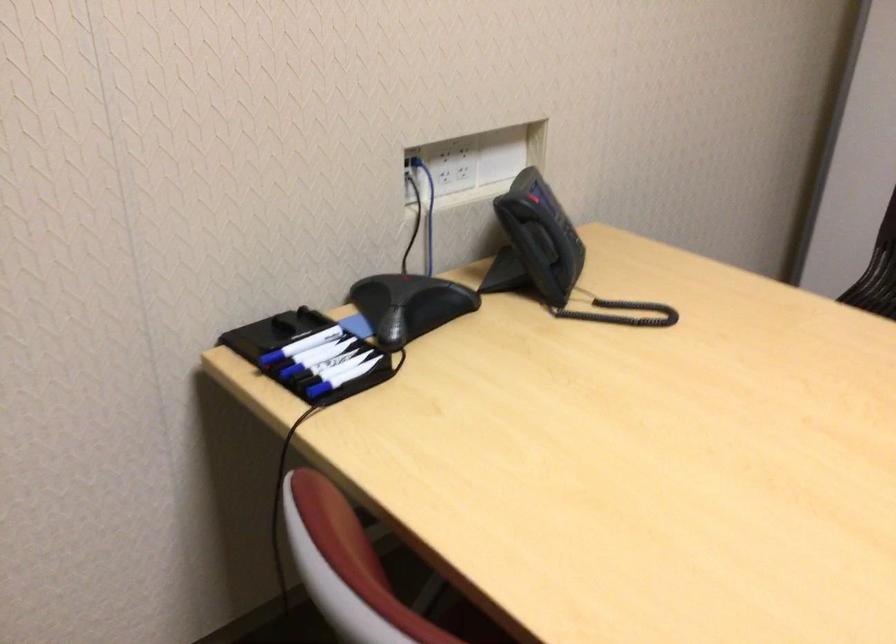
I want to click on telephone handset, so click(x=563, y=277).